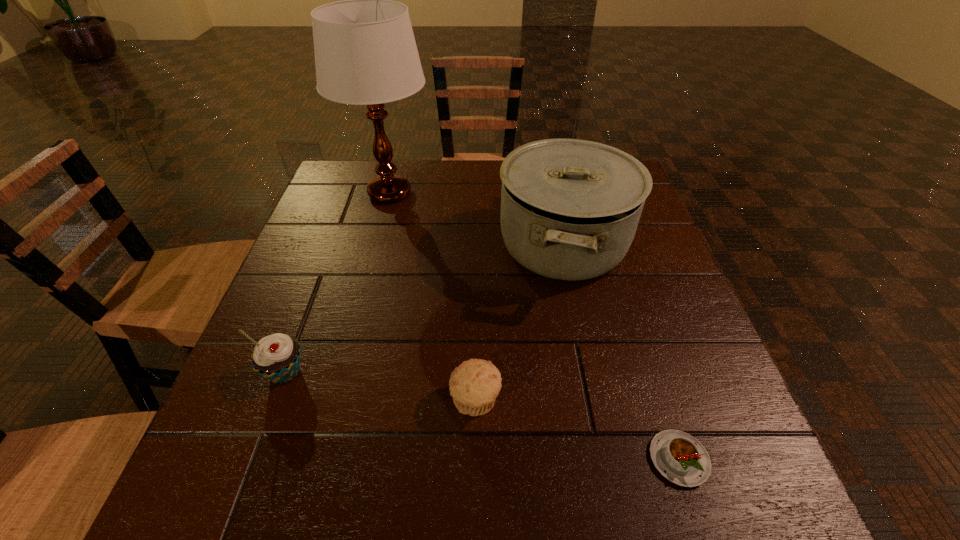
I want to click on the tallest object, so [365, 52].

You are a GUI agent. You are given a task and a screenshot of the screen. Output one action in this format:
    pyautogui.click(x=<x>, y=<y>)
    Task: Click on the saucepan
    This screenshot has height=540, width=960.
    Given the screenshot: What is the action you would take?
    pyautogui.click(x=570, y=208)

At what (x,y) coordinates should I click in order to perform the action: click on cupcake. Please return your answer as a coordinate pair (x, y). Image resolution: width=960 pixels, height=540 pixels. Looking at the image, I should click on (276, 357).

I want to click on muffin, so (474, 385).

Locate an element on the screen. Image resolution: width=960 pixels, height=540 pixels. the second shortest object is located at coordinates (474, 385).

This screenshot has height=540, width=960. What are the coordinates of `the nearest object` in the screenshot? It's located at point(682,459).

The height and width of the screenshot is (540, 960). I want to click on the shortest object, so click(682, 459).

This screenshot has width=960, height=540. I want to click on free region located 0.290m on the front of the tallest object, so click(360, 305).

At what (x,y) coordinates should I click in order to perform the action: click on vacant space located on the left of the fourth shortest object. Please return your answer as a coordinate pair (x, y). Looking at the image, I should click on (361, 245).

Find the location of a particular element. The image size is (960, 540). vacant area situated 0.050m on the front of the cupcake is located at coordinates (267, 421).